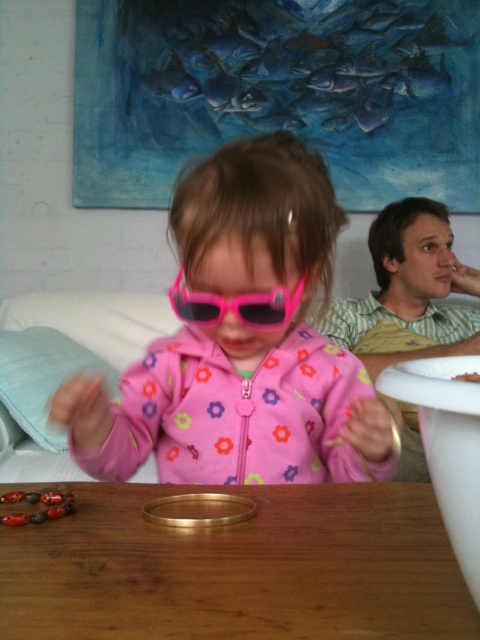
Measure the distance from wooden table at center to white plastic bowl at upper right.

The distance of wooden table at center from white plastic bowl at upper right is 10.19 inches.

Who is more forward, (x=338, y=529) or (x=479, y=374)?

Point (x=479, y=374) is more forward.

Where is `wooden table at center`? wooden table at center is located at coordinates (237, 568).

Which is behind, point (39, 445) or point (182, 301)?

The point (39, 445) is more distant.

Who is positioned more to the left, light blue fabric pillow at lower left or pink plastic goggles at center?

From the viewer's perspective, light blue fabric pillow at lower left appears more on the left side.

Where is `light blue fabric pillow at lower left`? The height and width of the screenshot is (640, 480). light blue fabric pillow at lower left is located at coordinates (43, 378).

Between pink matte sunglasses at center and light blue fabric pillow at lower left, which one appears on the left side from the viewer's perspective?

Positioned to the left is light blue fabric pillow at lower left.

Is pink matte sunglasses at center positioned at the back of light blue fabric pillow at lower left?

No, it is in front of light blue fabric pillow at lower left.

Is point (106, 428) positioned after point (60, 380)?

No, (106, 428) is closer to viewer.

You are a GUI agent. You are given a task and a screenshot of the screen. Output one action in this format:
    pyautogui.click(x=<x>, y=<y>)
    Task: Click on the pink matte sunglasses at center
    Image resolution: width=480 pixels, height=640 pixels.
    Given the screenshot: What is the action you would take?
    pyautogui.click(x=240, y=342)